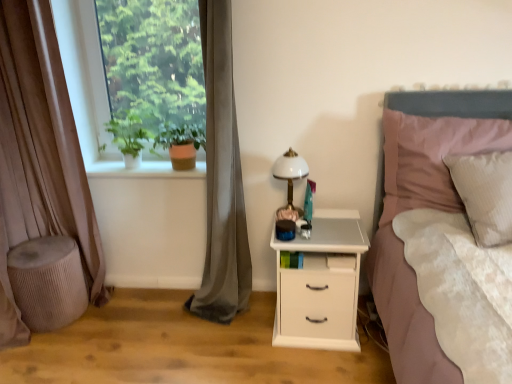
Question: Is pink fabric pillow at right a part of smooth white surface at center left?

Choices:
 (A) no
 (B) yes

Answer: (A)

Question: Can you confirm if smooth white surface at center left is taller than pink fabric pillow at right?

Choices:
 (A) yes
 (B) no

Answer: (B)

Question: Is smooth white surface at center left smaller than pink fabric pillow at right?

Choices:
 (A) no
 (B) yes

Answer: (B)

Question: Is pink fabric pillow at right at the back of smooth white surface at center left?

Choices:
 (A) no
 (B) yes

Answer: (A)

Question: From the image's perspective, is smooth white surface at center left under pink fabric pillow at right?

Choices:
 (A) no
 (B) yes

Answer: (A)

Question: Can you confirm if smooth white surface at center left is bigger than pink fabric pillow at right?

Choices:
 (A) no
 (B) yes

Answer: (A)

Question: Is white glossy bedside lamp at center-right further to the viewer compared to gray velvet curtain at left, the first curtain in the right-to-left sequence?

Choices:
 (A) yes
 (B) no

Answer: (A)

Question: Is white glossy bedside lamp at center-right next to gray velvet curtain at left, positioned as the second curtain in left-to-right order?

Choices:
 (A) yes
 (B) no

Answer: (B)

Question: Can you confirm if white glossy bedside lamp at center-right is taller than gray velvet curtain at left, positioned as the second curtain in left-to-right order?

Choices:
 (A) no
 (B) yes

Answer: (A)

Question: Is white glossy bedside lamp at center-right not close to gray velvet curtain at left, positioned as the second curtain in left-to-right order?

Choices:
 (A) yes
 (B) no

Answer: (B)

Question: Can you confirm if white glossy bedside lamp at center-right is positioned to the left of gray velvet curtain at left, the first curtain in the right-to-left sequence?

Choices:
 (A) no
 (B) yes

Answer: (A)

Question: Can you confirm if white glossy bedside lamp at center-right is thinner than gray velvet curtain at left, the first curtain in the right-to-left sequence?

Choices:
 (A) no
 (B) yes

Answer: (B)

Question: Does textured beige stool at lower left have a lesser width compared to green matte plant at upper left, positioned as the 1th plant in left-to-right order?

Choices:
 (A) yes
 (B) no

Answer: (B)